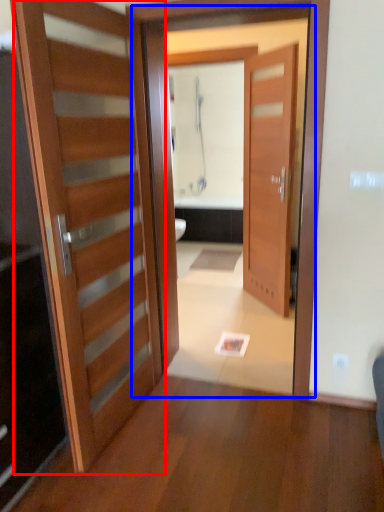
Question: Among these objects, which one is nearest to the camera, door (highlighted by a red box) or screen door (highlighted by a blue box)?

Choices:
 (A) door
 (B) screen door

Answer: (A)